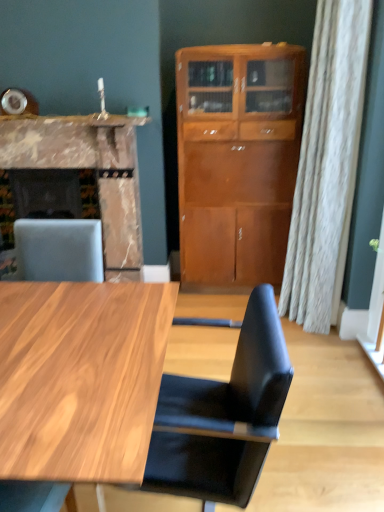
Question: Could you tell me if black leather chair at center is turned towards marble fireplace at left?

Choices:
 (A) no
 (B) yes

Answer: (A)

Question: Is black leather chair at center further to camera compared to marble fireplace at left?

Choices:
 (A) no
 (B) yes

Answer: (A)

Question: Considering the relative sizes of black leather chair at center and marble fireplace at left in the image provided, is black leather chair at center taller than marble fireplace at left?

Choices:
 (A) no
 (B) yes

Answer: (A)

Question: Are black leather chair at center and marble fireplace at left far apart?

Choices:
 (A) yes
 (B) no

Answer: (A)

Question: Can you confirm if black leather chair at center is wider than marble fireplace at left?

Choices:
 (A) yes
 (B) no

Answer: (B)

Question: Looking at their shapes, would you say light brown wood cabinet at center is wider or thinner than marble fireplace at left?

Choices:
 (A) thin
 (B) wide

Answer: (A)

Question: Considering the relative positions of light brown wood cabinet at center and marble fireplace at left in the image provided, is light brown wood cabinet at center to the left or to the right of marble fireplace at left?

Choices:
 (A) left
 (B) right

Answer: (B)

Question: Based on their sizes in the image, would you say light brown wood cabinet at center is bigger or smaller than marble fireplace at left?

Choices:
 (A) big
 (B) small

Answer: (B)

Question: From a real-world perspective, is light brown wood cabinet at center positioned above or below marble fireplace at left?

Choices:
 (A) below
 (B) above

Answer: (B)

Question: Is black leather chair at center bigger or smaller than marble fireplace at left?

Choices:
 (A) big
 (B) small

Answer: (B)

Question: Considering the positions of black leather chair at center and marble fireplace at left in the image, is black leather chair at center wider or thinner than marble fireplace at left?

Choices:
 (A) thin
 (B) wide

Answer: (A)

Question: From a real-world perspective, is black leather chair at center above or below marble fireplace at left?

Choices:
 (A) above
 (B) below

Answer: (B)

Question: Which is correct: black leather chair at center is inside marble fireplace at left, or outside of it?

Choices:
 (A) inside
 (B) outside

Answer: (B)

Question: In the image, is marble fireplace at left positioned in front of or behind marble countertop at upper left?

Choices:
 (A) behind
 (B) front

Answer: (A)

Question: Is marble fireplace at left wider or thinner than marble countertop at upper left?

Choices:
 (A) thin
 (B) wide

Answer: (B)